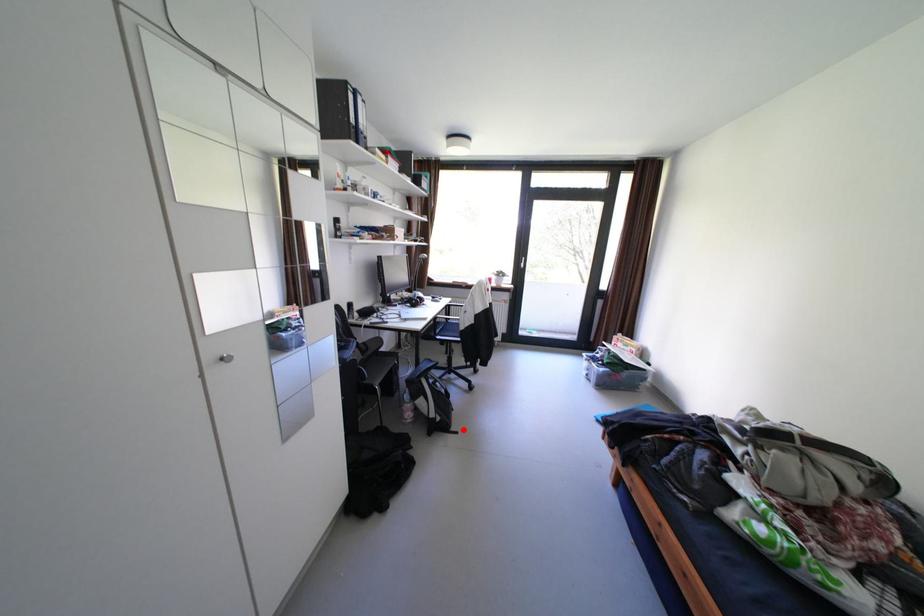
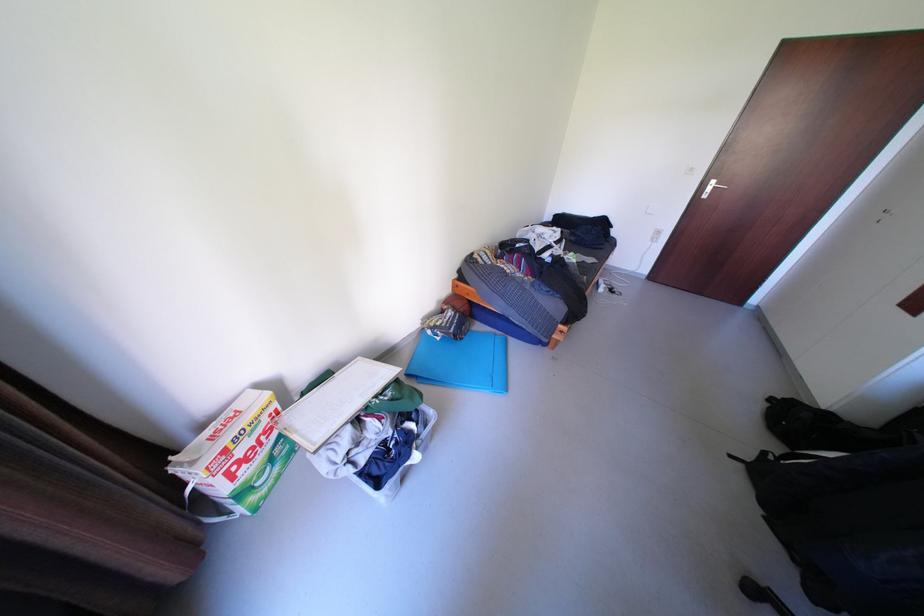
The point at the highlighted location is marked in the first image. Where is the corresponding point in the second image?

(752, 466)